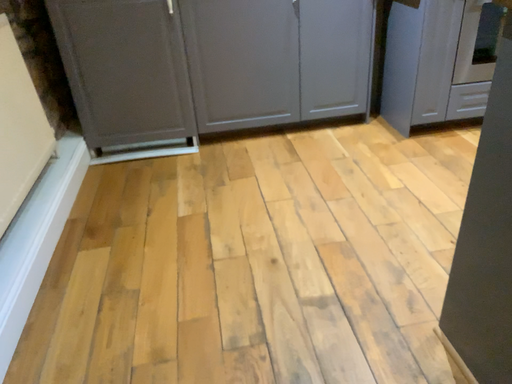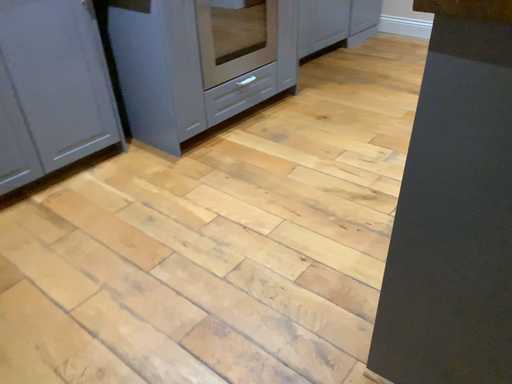
Question: Which way did the camera rotate in the video?

Choices:
 (A) rotated downward
 (B) rotated upward

Answer: (B)